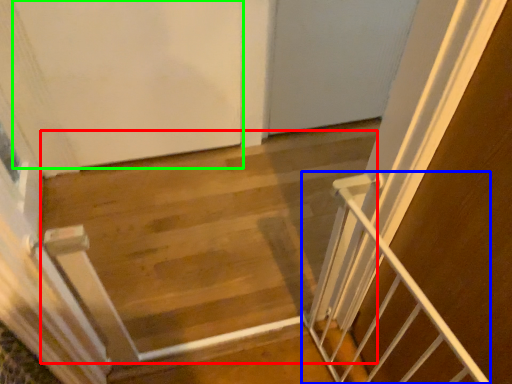
Question: Which object is the closest to the stairwell (highlighted by a red box)? Choose among these: stairs (highlighted by a blue box) or door (highlighted by a green box).

Choices:
 (A) stairs
 (B) door

Answer: (B)